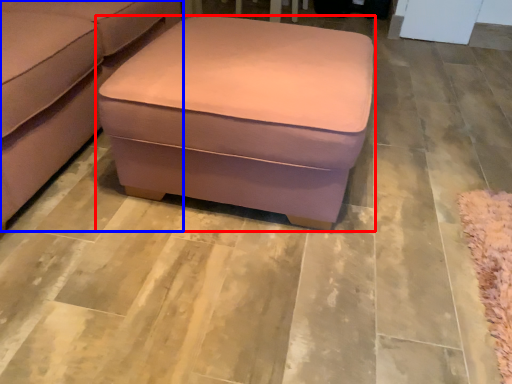
Question: Which point is further to the camera, table (highlighted by a red box) or studio couch (highlighted by a blue box)?

Choices:
 (A) table
 (B) studio couch

Answer: (A)